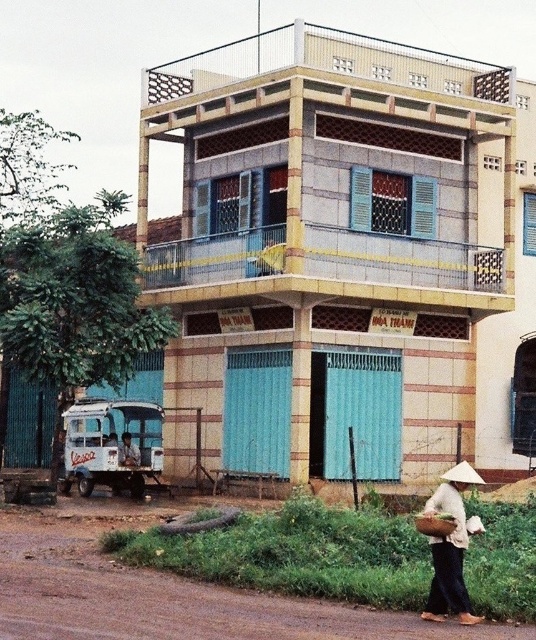
Question: Is white woven basket at lower right bigger than white straw hat at lower right?

Choices:
 (A) yes
 (B) no

Answer: (A)

Question: Where is white woven basket at lower right located in relation to brown woven basket at lower right in the image?

Choices:
 (A) left
 (B) right

Answer: (B)

Question: Which is farther from the brown woven basket at lower right?

Choices:
 (A) white straw hat at lower right
 (B) brown dirt track at lower left

Answer: (A)

Question: Which of the following is the closest to the observer?

Choices:
 (A) (435, 513)
 (B) (71, 563)

Answer: (A)

Question: Does brown dirt track at lower left have a lesser width compared to white woven basket at lower right?

Choices:
 (A) no
 (B) yes

Answer: (A)

Question: Which point appears closest to the camera in this image?

Choices:
 (A) (448, 580)
 (B) (465, 460)

Answer: (A)